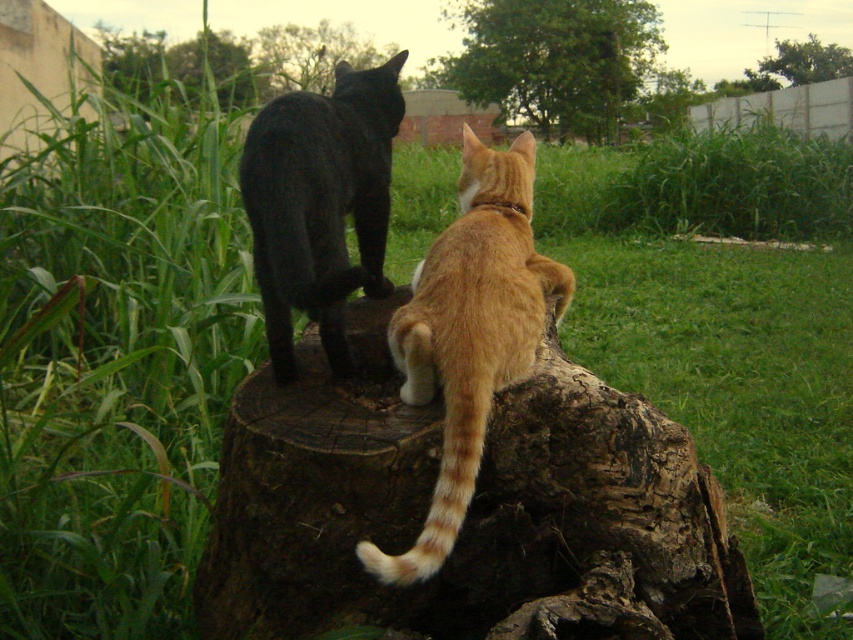
You are standing at the point labeled as point (467, 512) in the image. Looking around, you see the brown rough tree trunk at center. What is the nearest object to you in this scene?

The nearest object to you at point (467, 512) is the brown rough tree trunk at center since the point corresponds to its location.